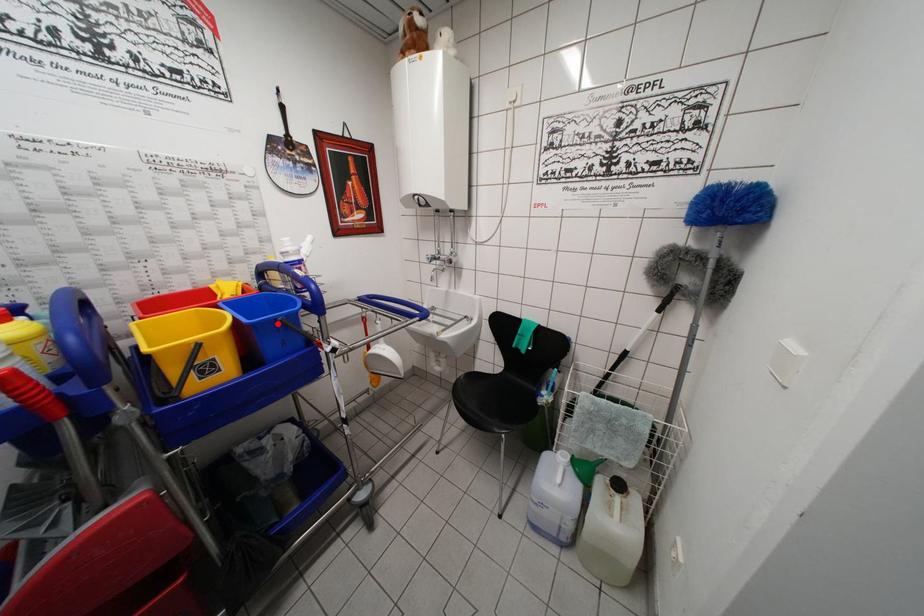
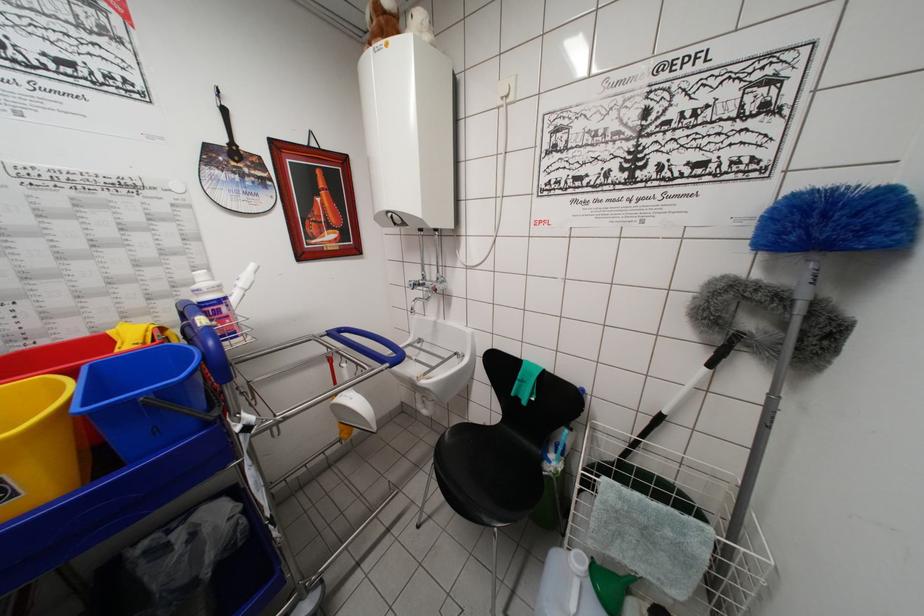
Question: I am providing you with two images of the same scene from different viewpoints. A red point is shown in image1. For the corresponding object point in image2, is it positioned nearer or farther from the camera?

Choices:
 (A) Nearer
 (B) Farther

Answer: (B)